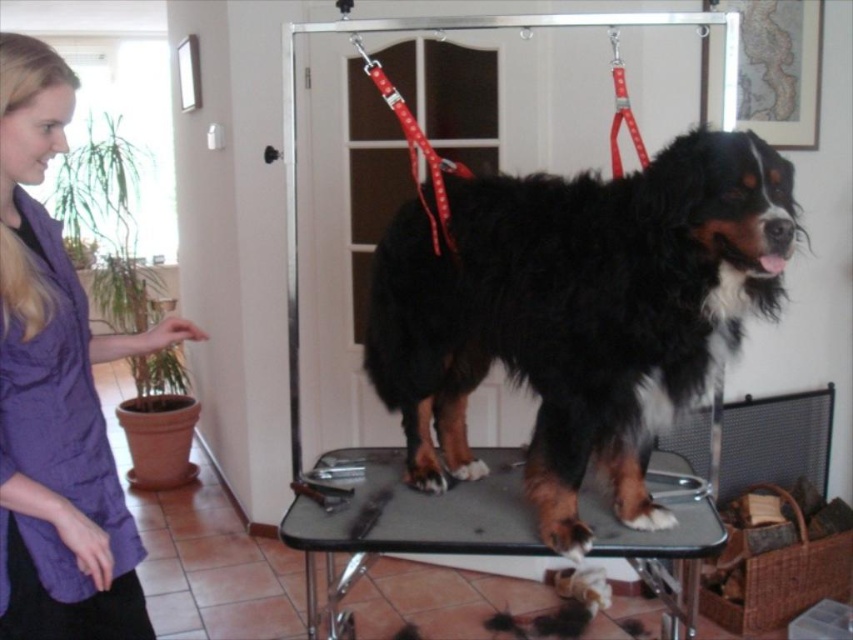
Between black shaggy dog at center and purple fabric shirt at left, which one has less height?

black shaggy dog at center

Does point (404, 372) lie behind point (44, 51)?

That is True.

Does point (607, 188) come in front of point (22, 552)?

That is False.

The image size is (853, 640). I want to click on black shaggy dog at center, so click(579, 312).

Which is more to the right, black shaggy dog at center or metallic gray grooming table at center?

black shaggy dog at center

Which is in front, point (700, 314) or point (618, 534)?

Point (700, 314)

Locate an element on the screen. This screenshot has height=640, width=853. black shaggy dog at center is located at coordinates (579, 312).

Does purple fabric shirt at left have a smaller size compared to metallic gray grooming table at center?

Yes.

Can you confirm if purple fabric shirt at left is thinner than metallic gray grooming table at center?

Yes, purple fabric shirt at left is thinner than metallic gray grooming table at center.

Who is more distant from viewer, (20,632) or (370,493)?

Positioned behind is point (370,493).

Locate an element on the screen. purple fabric shirt at left is located at coordinates (56, 392).